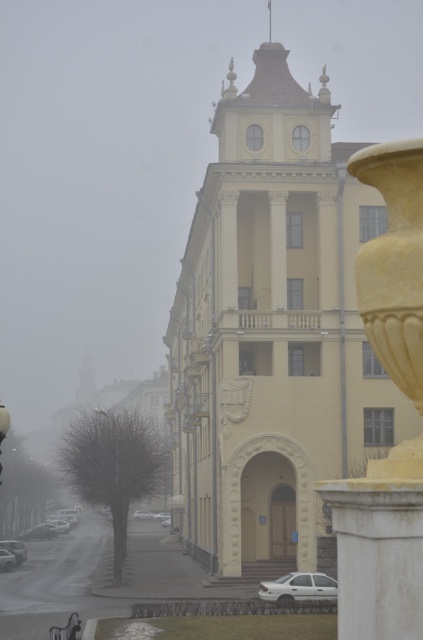
Which is behind, point (32, 532) or point (21, 552)?

Positioned behind is point (32, 532).

Looking at this image, which is more to the left, matte black car at lower left or white matte car at lower left?

From the viewer's perspective, matte black car at lower left appears more on the left side.

Where is `matte black car at lower left`? matte black car at lower left is located at coordinates (41, 532).

Between white marble pillar at right and brushed metal lamp post at left, which one has more height?

With more height is white marble pillar at right.

The height and width of the screenshot is (640, 423). I want to click on white marble pillar at right, so click(x=379, y=545).

Is point (10, 420) farther from viewer compared to point (3, 548)?

That is False.

Is brushed metal lamp post at left closer to camera compared to white glossy car at lower left?

Yes, brushed metal lamp post at left is in front of white glossy car at lower left.

Which is in front, point (0, 419) or point (11, 563)?

Positioned in front is point (0, 419).

This screenshot has width=423, height=640. I want to click on brushed metal lamp post at left, so click(3, 422).